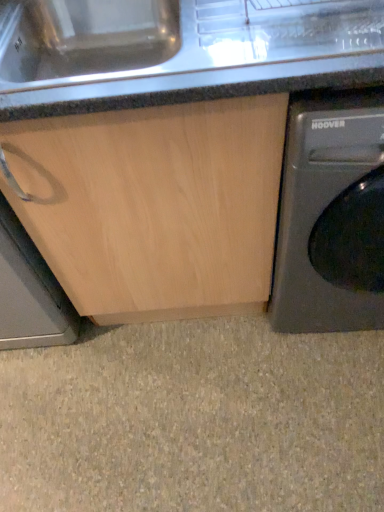
Consider the image. In order to face metallic gray washing machine at right, should I rotate leftwards or rightwards?

To align with it, rotate right about 21.798°.

In order to face beige wood cabinet at lower left, should I rotate leftwards or rightwards?

Turn left by 0.530 degrees to look at beige wood cabinet at lower left.

Locate an element on the screen. The width and height of the screenshot is (384, 512). granite countertop at center is located at coordinates (180, 51).

Is beige wood cabinet at lower left placed right next to granite countertop at center?

No, beige wood cabinet at lower left is not next to granite countertop at center.

What's the angular difference between beige wood cabinet at lower left and granite countertop at center's facing directions?

The angle between the facing direction of beige wood cabinet at lower left and the facing direction of granite countertop at center is 2.26e-05 degrees.

From the image's perspective, which is below, beige wood cabinet at lower left or granite countertop at center?

beige wood cabinet at lower left is shown below in the image.

From a real-world perspective, between beige wood cabinet at lower left and granite countertop at center, who is vertically higher?

From a 3D spatial view, granite countertop at center is above.

Image resolution: width=384 pixels, height=512 pixels. Find the location of `counter top in front of the metallic gray washing machine at right`. counter top in front of the metallic gray washing machine at right is located at coordinates (x=180, y=51).

Considering the sizes of objects granite countertop at center and metallic gray washing machine at right in the image provided, who is taller, granite countertop at center or metallic gray washing machine at right?

metallic gray washing machine at right is taller.

Between granite countertop at center and metallic gray washing machine at right, which one has larger size?

metallic gray washing machine at right.

From the image's perspective, does beige wood cabinet at lower left appear higher than metallic gray washing machine at right?

No, from the image's perspective, beige wood cabinet at lower left is not above metallic gray washing machine at right.

Is point (136, 435) closer to camera compared to point (347, 160)?

No, it is behind (347, 160).

Can you confirm if beige wood cabinet at lower left is bigger than metallic gray washing machine at right?

No, beige wood cabinet at lower left is not bigger than metallic gray washing machine at right.

Are beige wood cabinet at lower left and metallic gray washing machine at right making contact?

No, beige wood cabinet at lower left is not with metallic gray washing machine at right.

Which of these two, metallic gray washing machine at right or granite countertop at center, stands shorter?

With less height is granite countertop at center.

From a real-world perspective, is metallic gray washing machine at right beneath granite countertop at center?

Yes, from a real-world perspective, metallic gray washing machine at right is under granite countertop at center.

Which of these two, metallic gray washing machine at right or granite countertop at center, is smaller?

granite countertop at center is smaller.

Can you confirm if granite countertop at center is positioned to the left of beige wood cabinet at lower left?

Incorrect, granite countertop at center is not on the left side of beige wood cabinet at lower left.

Is granite countertop at center not near beige wood cabinet at lower left?

No, granite countertop at center is not far from beige wood cabinet at lower left.

Is metallic gray washing machine at right far from beige wood cabinet at lower left?

No, metallic gray washing machine at right is not far from beige wood cabinet at lower left.

Would you say beige wood cabinet at lower left is part of metallic gray washing machine at right's contents?

No, beige wood cabinet at lower left is not surrounded by metallic gray washing machine at right.

Does metallic gray washing machine at right have a lesser width compared to beige wood cabinet at lower left?

In fact, metallic gray washing machine at right might be wider than beige wood cabinet at lower left.

Is metallic gray washing machine at right at the left side of beige wood cabinet at lower left?

Incorrect, metallic gray washing machine at right is not on the left side of beige wood cabinet at lower left.

Identify the location of granite that appears below the granite countertop at center (from the image's perspective). [x=194, y=420].

The image size is (384, 512). I want to click on washing machine on the right of granite countertop at center, so click(331, 216).

When comparing their distances from granite countertop at center, does beige wood cabinet at lower left or metallic gray washing machine at right seem further?

The object further to granite countertop at center is beige wood cabinet at lower left.

Looking at the image, which one is located further to beige wood cabinet at lower left, granite countertop at center or metallic gray washing machine at right?

granite countertop at center is positioned further to the anchor beige wood cabinet at lower left.

When comparing their distances from metallic gray washing machine at right, does granite countertop at center or beige wood cabinet at lower left seem further?

beige wood cabinet at lower left is further to metallic gray washing machine at right.

Estimate the real-world distances between objects in this image. Which object is further from metallic gray washing machine at right, beige wood cabinet at lower left or granite countertop at center?

beige wood cabinet at lower left.

Estimate the real-world distances between objects in this image. Which object is further from granite countertop at center, metallic gray washing machine at right or beige wood cabinet at lower left?

Result: Based on the image, beige wood cabinet at lower left appears to be further to granite countertop at center.

From the image, which object appears to be nearer to beige wood cabinet at lower left, metallic gray washing machine at right or granite countertop at center?

metallic gray washing machine at right is closer to beige wood cabinet at lower left.

Identify the location of washing machine between granite countertop at center and beige wood cabinet at lower left from top to bottom. This screenshot has width=384, height=512. (331, 216).